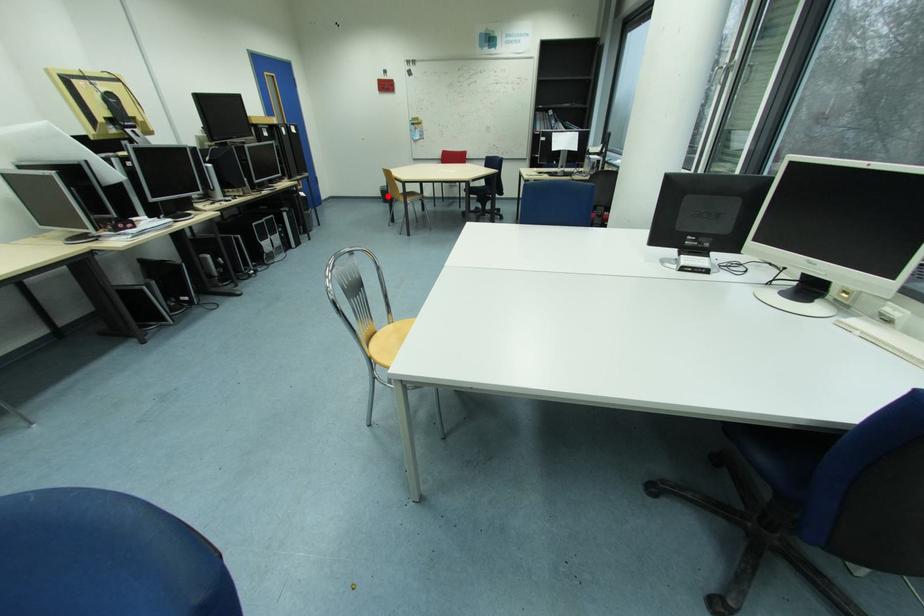
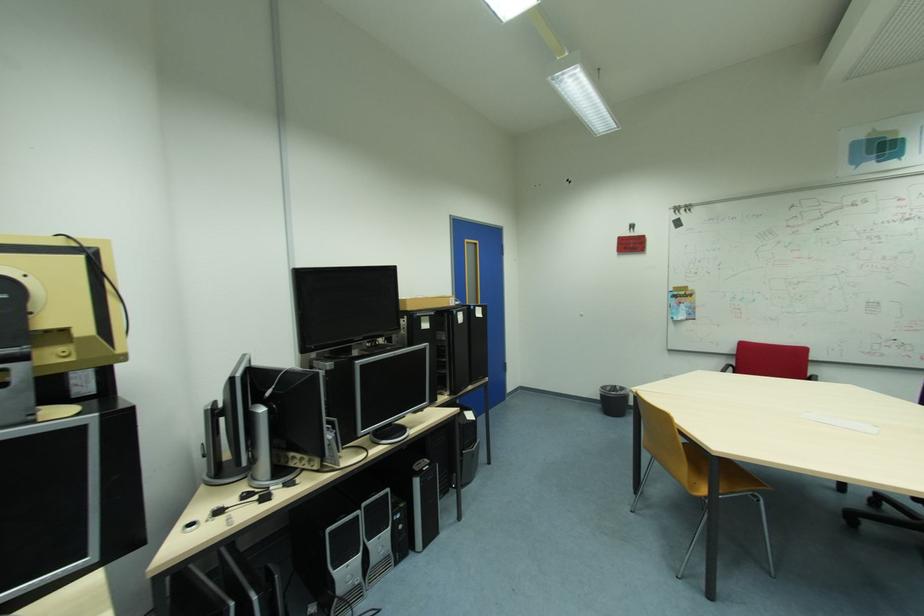
Question: I am providing you with two images of the same scene from different viewpoints. Image1 has a red point marked. In image2, the corresponding 3D location appears at what relative position? Reply with the corresponding letter.

Choices:
 (A) Closer
 (B) Farther

Answer: (B)